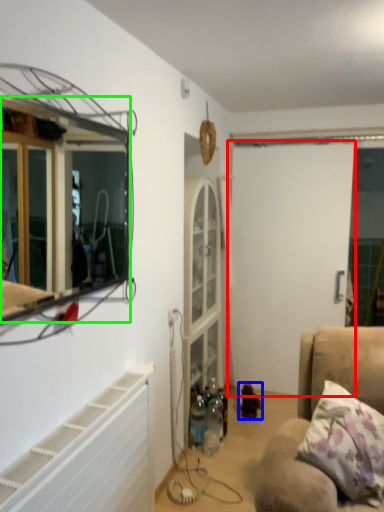
Question: Estimate the real-world distances between objects in this image. Which object is closer to screen door (highlighted by a red box), toy (highlighted by a blue box) or mirror (highlighted by a green box)?

Choices:
 (A) toy
 (B) mirror

Answer: (A)